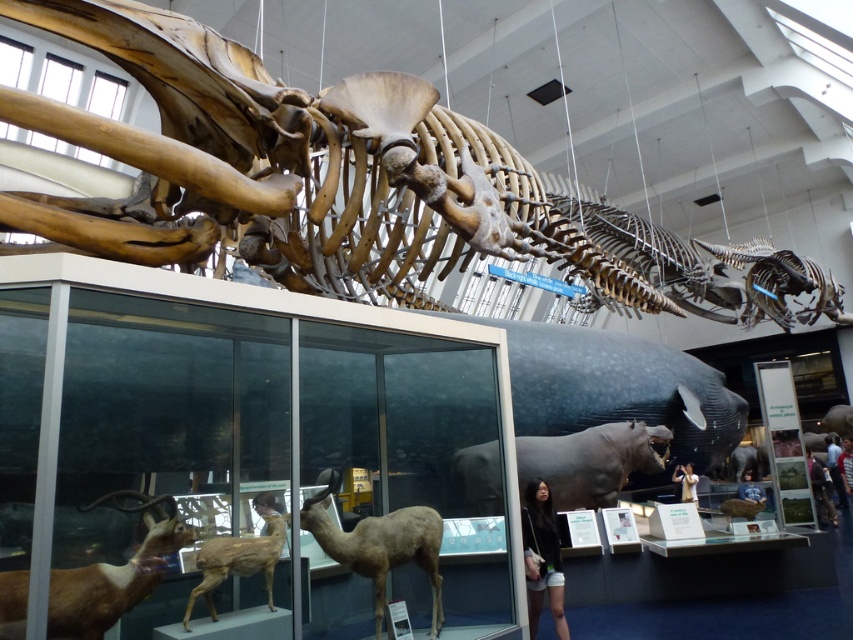
Question: Among these points, which one is nearest to the camera?

Choices:
 (A) (212, 541)
 (B) (16, 579)

Answer: (B)

Question: Does brown matte hippo at center appear on the left side of brown matte hippopotamus at center?

Choices:
 (A) no
 (B) yes

Answer: (B)

Question: Which of the following is the closest to the observer?

Choices:
 (A) brown matte/deer at lower left
 (B) brown matte hippopotamus at center
 (C) brown matte hippo at center

Answer: (A)

Question: Does brown matte hippo at center appear on the left side of matte black hair at center?

Choices:
 (A) yes
 (B) no

Answer: (B)

Question: Among these points, which one is nearest to the camera?

Choices:
 (A) (692, 483)
 (B) (538, 556)
 (C) (328, 550)
 (D) (608, 442)

Answer: (C)

Question: Does brown matte hippo at center have a greater width compared to brown matte/deer at lower left?

Choices:
 (A) yes
 (B) no

Answer: (A)